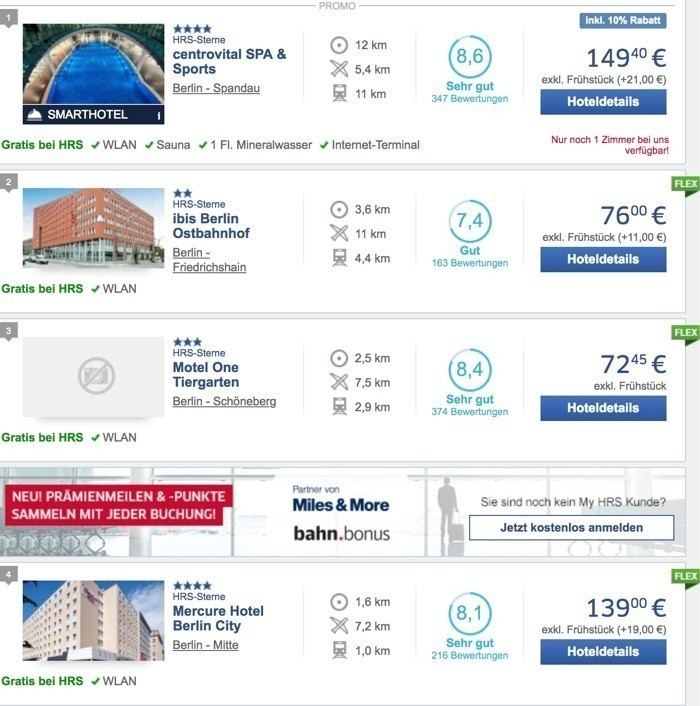
The image size is (700, 706). Find the location of `hotel image`. hotel image is located at coordinates (89, 61), (99, 209), (97, 370), (88, 630).